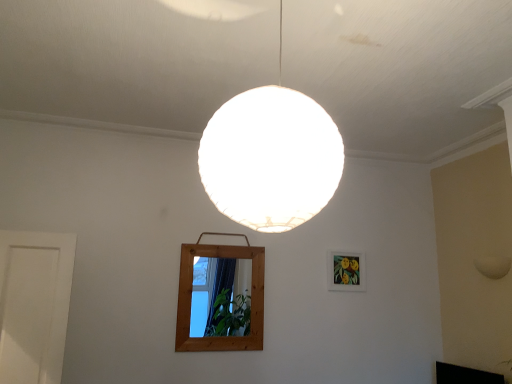
Question: From a real-world perspective, is wooden mirror at center below matte wooden picture frame at upper right?

Choices:
 (A) yes
 (B) no

Answer: (A)

Question: Does wooden mirror at center have a larger size compared to matte wooden picture frame at upper right?

Choices:
 (A) no
 (B) yes

Answer: (B)

Question: Is wooden mirror at center wider than matte wooden picture frame at upper right?

Choices:
 (A) yes
 (B) no

Answer: (A)

Question: Is wooden mirror at center at the right side of matte wooden picture frame at upper right?

Choices:
 (A) no
 (B) yes

Answer: (A)

Question: Is wooden mirror at center positioned with its back to matte wooden picture frame at upper right?

Choices:
 (A) no
 (B) yes

Answer: (A)

Question: From the image's perspective, would you say wooden mirror at center is shown under matte wooden picture frame at upper right?

Choices:
 (A) no
 (B) yes

Answer: (B)

Question: Is black glossy tv at lower right not inside matte wooden picture frame at upper right?

Choices:
 (A) no
 (B) yes

Answer: (B)

Question: Considering the relative positions of black glossy tv at lower right and matte wooden picture frame at upper right in the image provided, is black glossy tv at lower right to the right of matte wooden picture frame at upper right from the viewer's perspective?

Choices:
 (A) no
 (B) yes

Answer: (B)

Question: Does black glossy tv at lower right have a lesser width compared to matte wooden picture frame at upper right?

Choices:
 (A) no
 (B) yes

Answer: (A)

Question: From a real-world perspective, is black glossy tv at lower right below matte wooden picture frame at upper right?

Choices:
 (A) no
 (B) yes

Answer: (B)

Question: Can you confirm if black glossy tv at lower right is shorter than matte wooden picture frame at upper right?

Choices:
 (A) no
 (B) yes

Answer: (B)

Question: Could matte wooden picture frame at upper right be considered to be inside black glossy tv at lower right?

Choices:
 (A) yes
 (B) no

Answer: (B)

Question: Considering the relative sizes of matte wooden picture frame at upper right and white matte sphere at center in the image provided, is matte wooden picture frame at upper right taller than white matte sphere at center?

Choices:
 (A) yes
 (B) no

Answer: (B)